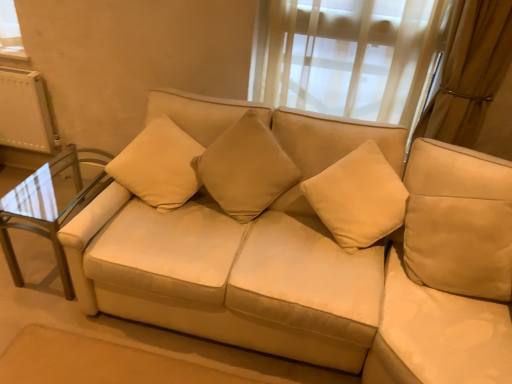
Question: Is clear glass table at left spatially inside suede-like beige pillow at center, which is the 2th pillow from left to right, or outside of it?

Choices:
 (A) inside
 (B) outside

Answer: (B)

Question: Visually, is clear glass table at left positioned to the left or to the right of suede-like beige pillow at center, which is the first pillow in right-to-left order?

Choices:
 (A) right
 (B) left

Answer: (B)

Question: Which object is positioned farthest from the clear glass table at left?

Choices:
 (A) suede-like beige pillow at center, which is the 2th pillow from left to right
 (B) beige fabric pillow at upper left, arranged as the first pillow when viewed from the left
 (C) beige fabric couch at center
 (D) beige fabric cushion at right

Answer: (D)

Question: Estimate the real-world distances between objects in this image. Which object is closer to the beige fabric cushion at right?

Choices:
 (A) beige fabric couch at center
 (B) clear glass table at left
 (C) beige fabric pillow at upper left, arranged as the first pillow when viewed from the left
 (D) suede-like beige pillow at center, which is the first pillow in right-to-left order

Answer: (A)